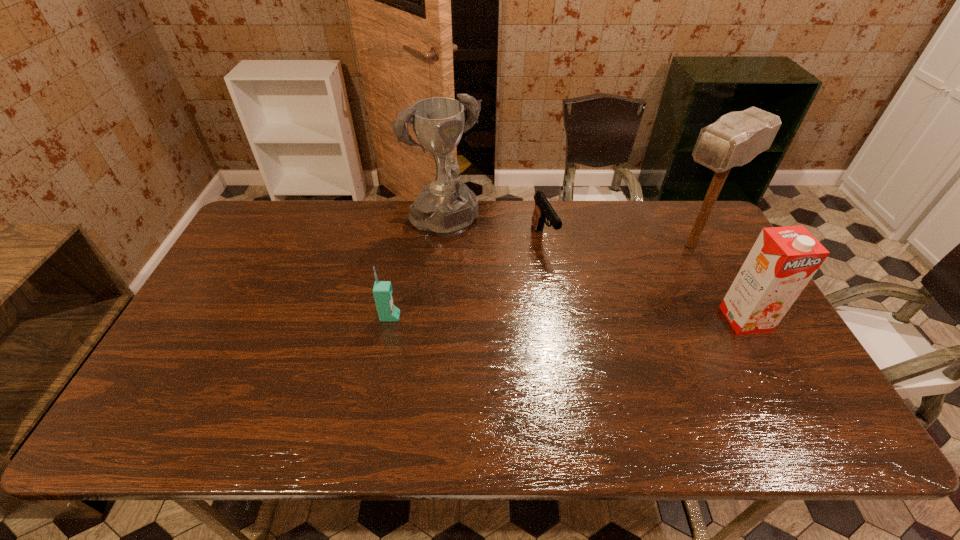
Find the location of a particular element. carton located at the right edge is located at coordinates (783, 260).

Find the location of a particular element. The height and width of the screenshot is (540, 960). mallet that is at the right edge is located at coordinates point(736,138).

At what (x,y) coordinates should I click in order to perform the action: click on object that is at the far right corner. Please return your answer as a coordinate pair (x, y). The width and height of the screenshot is (960, 540). Looking at the image, I should click on (736, 138).

I want to click on vacant area at the far edge, so click(319, 231).

Where is `free space at the near edge of the desktop`? This screenshot has width=960, height=540. free space at the near edge of the desktop is located at coordinates (684, 396).

Where is `free space at the left edge of the desktop`? free space at the left edge of the desktop is located at coordinates (213, 305).

Find the location of `vacant region at the far left corner of the desktop`. vacant region at the far left corner of the desktop is located at coordinates (246, 237).

At what (x,y) coordinates should I click in order to perform the action: click on vacant space at the near left corner of the desktop. Please return your answer as a coordinate pair (x, y). Looking at the image, I should click on (169, 383).

This screenshot has height=540, width=960. In the image, there is a desktop. Find the location of `free region at the far right corner`. free region at the far right corner is located at coordinates (684, 222).

Find the location of a particular element. free space between the second shortest object and the mallet is located at coordinates (540, 281).